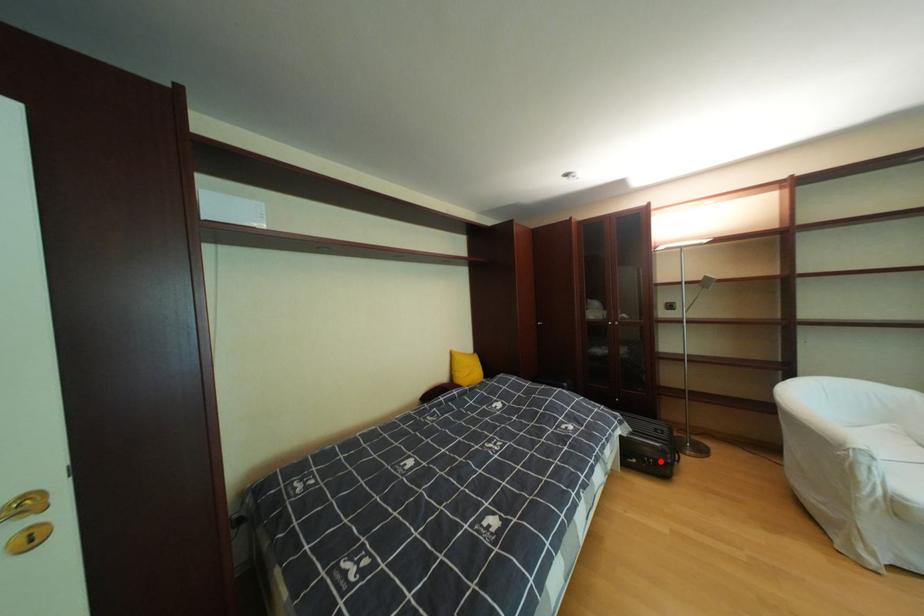
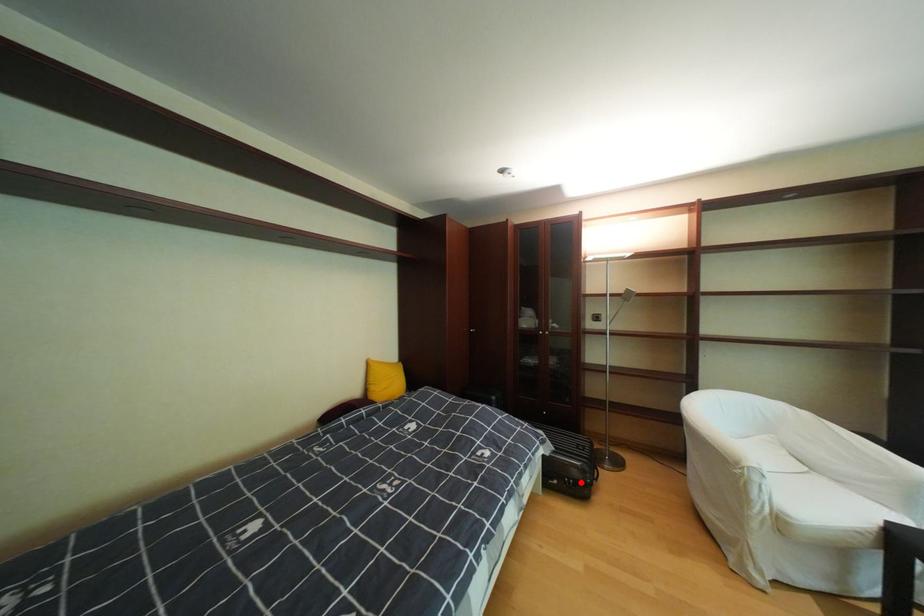
I am providing you with two images of the same scene from different viewpoints. A red point is marked on the first image and another point is marked on the second image. Is the marked point in image1 the same physical position as the marked point in image2?

Yes